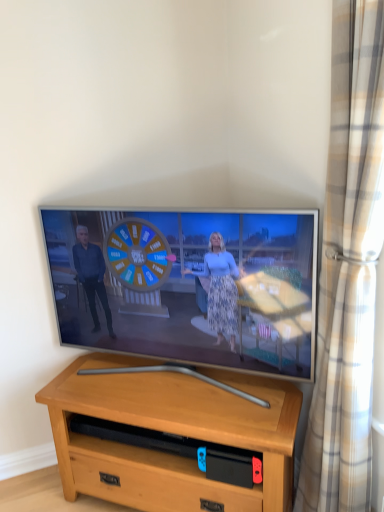
Where is `vacant space underneath flat screen tv at center (from a real-world perspective)`? The height and width of the screenshot is (512, 384). vacant space underneath flat screen tv at center (from a real-world perspective) is located at coordinates (190, 375).